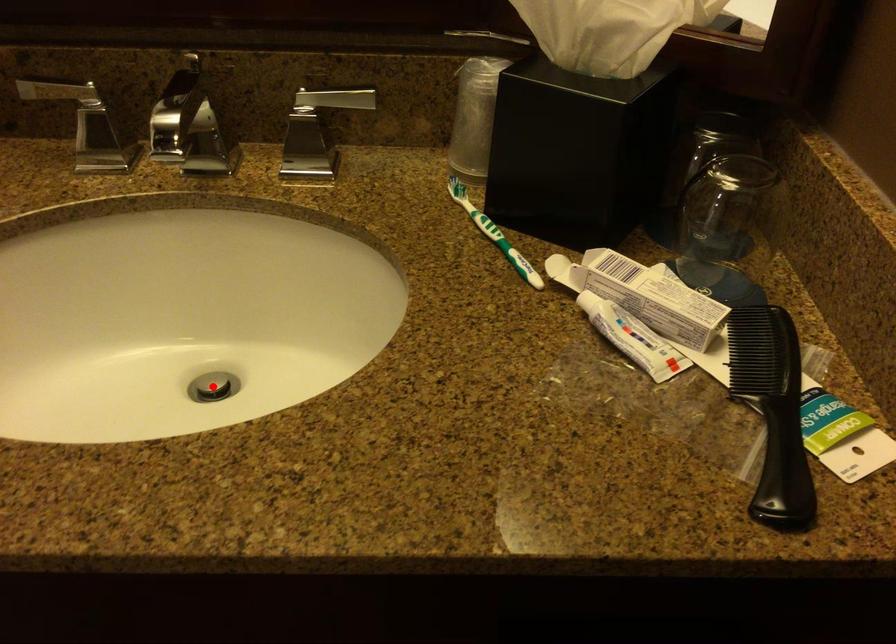
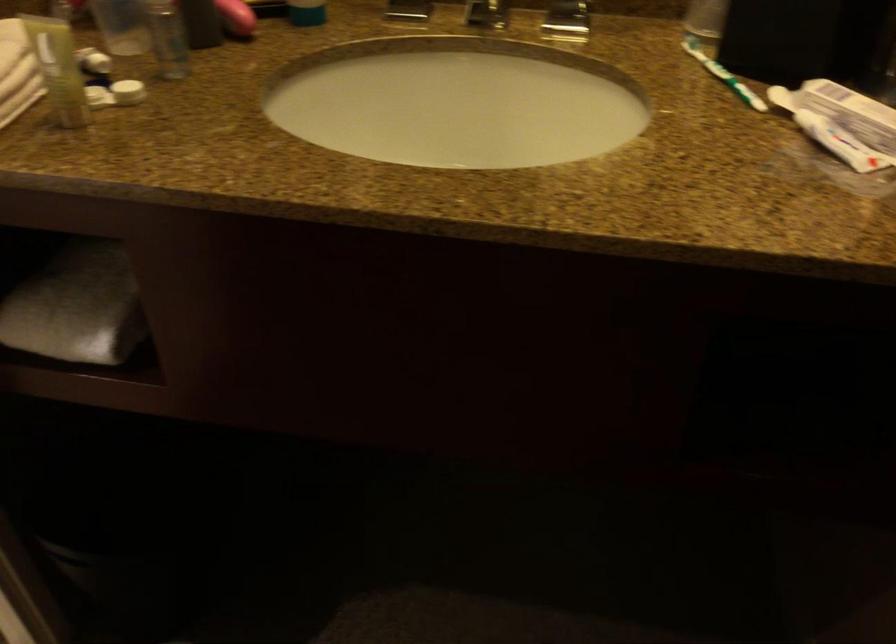
Question: I am providing you with two images of the same scene from different viewpoints. A red point is marked on the first image. Can you still see the location of the red point in image 2?

Choices:
 (A) Yes
 (B) No

Answer: (B)